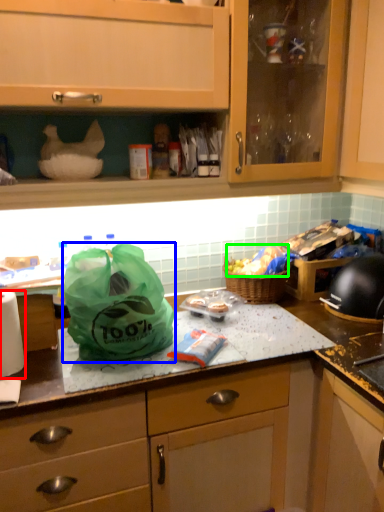
Question: Which object is the closest to the paper towel (highlighted by a red box)? Choose among these: plastic bag (highlighted by a blue box) or food (highlighted by a green box).

Choices:
 (A) plastic bag
 (B) food

Answer: (A)